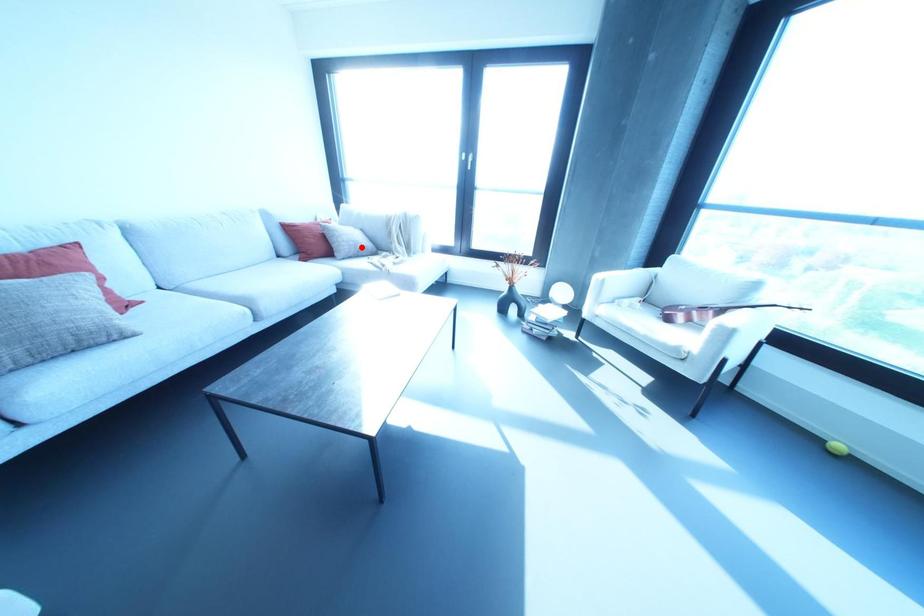
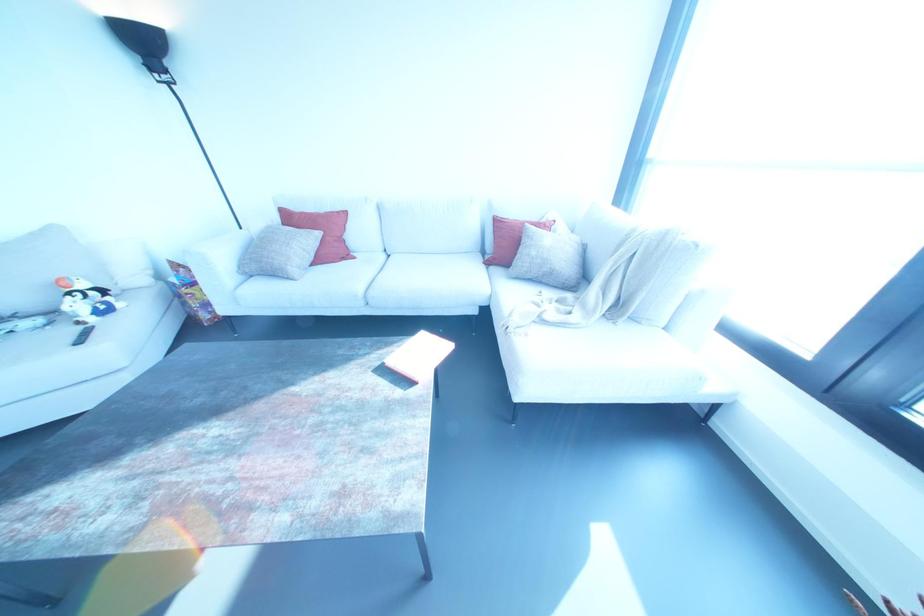
Find the pixel in the second image that matches the highlighted location in the first image.

(551, 273)